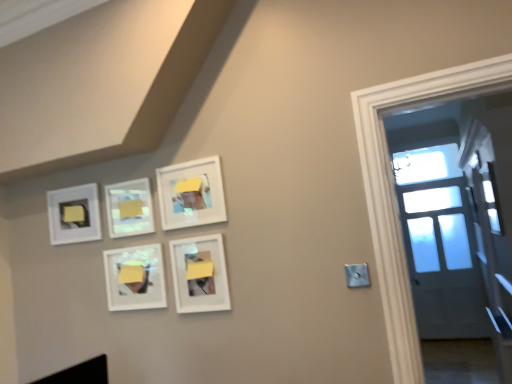
The width and height of the screenshot is (512, 384). What do you see at coordinates (74, 214) in the screenshot?
I see `matte white picture frame at upper left, which is counted as the 1th picture frame, starting from the left` at bounding box center [74, 214].

Identify the location of matte white picture frame at upper center, the 2th picture frame when ordered from left to right. The image size is (512, 384). (129, 208).

The image size is (512, 384). Identify the location of white matte picture frame at lower center, the 1th picture frame when ordered from right to left. (200, 274).

This screenshot has width=512, height=384. Describe the element at coordinates (130, 208) in the screenshot. I see `yellow matte paper at upper center, which appears as the first lift when viewed from the right` at that location.

What is the approximate height of matte white picture frame at upper center, the 2th picture frame from the right?

matte white picture frame at upper center, the 2th picture frame from the right, is 11.54 inches tall.

Locate an element on the screen. This screenshot has width=512, height=384. matte white picture frame at upper left, which appears as the 5th picture frame when viewed from the right is located at coordinates (74, 214).

Between yellow matte paper at upper center, which appears as the first lift when viewed from the right, and white matte picture frame at lower center, the 1th picture frame when ordered from right to left, which one has less height?

With less height is yellow matte paper at upper center, which appears as the first lift when viewed from the right.

How much distance is there between yellow matte paper at upper center, positioned as the first lift in front-to-back order, and white matte picture frame at lower center, the 1th picture frame when ordered from right to left?

yellow matte paper at upper center, positioned as the first lift in front-to-back order, is 15.53 inches from white matte picture frame at lower center, the 1th picture frame when ordered from right to left.

There is a white matte picture frame at lower center, which is the 5th picture frame from left to right. Where is `the 1st lift above it (from a real-world perspective)`? the 1st lift above it (from a real-world perspective) is located at coordinates (130, 208).

Between yellow matte paper at upper center, the 2th lift viewed from the back, and white matte picture frame at lower center, which is the 5th picture frame from left to right, which one has larger width?

white matte picture frame at lower center, which is the 5th picture frame from left to right, is wider.

Is yellow matte paper at upper left, arranged as the second lift when viewed from the right, smaller than white matte picture frame at lower center, which is the 5th picture frame from left to right?

Yes, yellow matte paper at upper left, arranged as the second lift when viewed from the right, is smaller than white matte picture frame at lower center, which is the 5th picture frame from left to right.

Looking at this image, from a real-world perspective, is yellow matte paper at upper left, which appears as the 1th lift when viewed from the left, above or below white matte picture frame at lower center, the 1th picture frame when ordered from right to left?

yellow matte paper at upper left, which appears as the 1th lift when viewed from the left, is situated higher than white matte picture frame at lower center, the 1th picture frame when ordered from right to left, in the real world.

Is yellow matte paper at upper left, which appears as the 1th lift when viewed from the left, oriented towards white matte picture frame at lower center, the 1th picture frame when ordered from right to left?

No.

Choose the correct answer: Is yellow matte paper at upper left, arranged as the second lift when viewed from the right, inside white matte picture frame at lower center, which is the 5th picture frame from left to right, or outside it?

yellow matte paper at upper left, arranged as the second lift when viewed from the right, is located beyond the bounds of white matte picture frame at lower center, which is the 5th picture frame from left to right.

In the scene shown: Is yellow matte paper at upper center, which appears as the first lift when viewed from the right, turned away from matte white picture frame at center-left, placed as the third picture frame when sorted from left to right?

No, matte white picture frame at center-left, placed as the third picture frame when sorted from left to right, is not at the back of yellow matte paper at upper center, which appears as the first lift when viewed from the right.

Where is `the 1st lift behind when counting from the matte white picture frame at center-left, placed as the third picture frame when sorted from left to right`? This screenshot has width=512, height=384. the 1st lift behind when counting from the matte white picture frame at center-left, placed as the third picture frame when sorted from left to right is located at coordinates (130, 208).

From a real-world perspective, is yellow matte paper at upper center, the 2th lift viewed from the back, positioned under matte white picture frame at center-left, the 3th picture frame viewed from the right, based on gravity?

No, from a real-world perspective, yellow matte paper at upper center, the 2th lift viewed from the back, is not beneath matte white picture frame at center-left, the 3th picture frame viewed from the right.

From a real-world perspective, is matte white picture frame at upper center, the 2th picture frame from the right, physically located above or below matte white picture frame at center-left, placed as the third picture frame when sorted from left to right?

matte white picture frame at upper center, the 2th picture frame from the right, is above matte white picture frame at center-left, placed as the third picture frame when sorted from left to right.

In terms of height, does matte white picture frame at upper center, the fourth picture frame from the left, look taller or shorter compared to matte white picture frame at center-left, placed as the third picture frame when sorted from left to right?

Clearly, matte white picture frame at upper center, the fourth picture frame from the left, is taller compared to matte white picture frame at center-left, placed as the third picture frame when sorted from left to right.

Does matte white picture frame at upper center, the 2th picture frame from the right, turn towards matte white picture frame at center-left, the 3th picture frame viewed from the right?

No, matte white picture frame at upper center, the 2th picture frame from the right, does not turn towards matte white picture frame at center-left, the 3th picture frame viewed from the right.

Would you say matte white picture frame at upper center, the fourth picture frame from the left, is outside matte white picture frame at center-left, placed as the third picture frame when sorted from left to right?

matte white picture frame at upper center, the fourth picture frame from the left, lies outside matte white picture frame at center-left, placed as the third picture frame when sorted from left to right,'s area.

Which is less distant, (65, 214) or (116, 211)?

Point (65, 214).

Does matte white picture frame at upper left, which is counted as the 1th picture frame, starting from the left, touch matte white picture frame at upper center, the 2th picture frame when ordered from left to right?

matte white picture frame at upper left, which is counted as the 1th picture frame, starting from the left, is not next to matte white picture frame at upper center, the 2th picture frame when ordered from left to right, and they're not touching.

Between matte white picture frame at center-left, the 3th picture frame viewed from the right, and matte white picture frame at upper left, which is counted as the 1th picture frame, starting from the left, which one has larger size?

matte white picture frame at center-left, the 3th picture frame viewed from the right, is bigger.

Is matte white picture frame at center-left, placed as the third picture frame when sorted from left to right, not within matte white picture frame at upper left, which is counted as the 1th picture frame, starting from the left?

Absolutely, matte white picture frame at center-left, placed as the third picture frame when sorted from left to right, is external to matte white picture frame at upper left, which is counted as the 1th picture frame, starting from the left.

From the image's perspective, is matte white picture frame at center-left, placed as the third picture frame when sorted from left to right, located beneath matte white picture frame at upper left, which appears as the 5th picture frame when viewed from the right?

Yes.

Could you tell me if yellow matte paper at upper left, which is the second lift from front to back, is turned towards matte white picture frame at upper left, which appears as the 5th picture frame when viewed from the right?

Yes, yellow matte paper at upper left, which is the second lift from front to back, is oriented towards matte white picture frame at upper left, which appears as the 5th picture frame when viewed from the right.

Is there a large distance between yellow matte paper at upper left, which appears as the first lift when viewed from the back, and matte white picture frame at upper left, which is counted as the 1th picture frame, starting from the left?

No, there isn't a large distance between yellow matte paper at upper left, which appears as the first lift when viewed from the back, and matte white picture frame at upper left, which is counted as the 1th picture frame, starting from the left.

Between yellow matte paper at upper left, which is the second lift from front to back, and matte white picture frame at upper left, which appears as the 5th picture frame when viewed from the right, which one has larger size?

Bigger between the two is matte white picture frame at upper left, which appears as the 5th picture frame when viewed from the right.

Find the location of a particular element. The width and height of the screenshot is (512, 384). lift that is the 1st one when counting backward from the white matte picture frame at lower center, which is the 5th picture frame from left to right is located at coordinates (130, 208).

From a real-world perspective, count 2nd lifts upward from the white matte picture frame at lower center, the 1th picture frame when ordered from right to left, and point to it. Please provide its 2D coordinates.

[(74, 214)]

Which object lies nearer to the anchor point matte white picture frame at upper center, the 2th picture frame when ordered from left to right, matte white picture frame at upper center, the 2th picture frame from the right, or white matte picture frame at lower center, which is the 5th picture frame from left to right?

Among the two, matte white picture frame at upper center, the 2th picture frame from the right, is located nearer to matte white picture frame at upper center, the 2th picture frame when ordered from left to right.

Which object lies nearer to the anchor point matte white picture frame at upper center, positioned as the 4th picture frame in right-to-left order, yellow matte paper at upper center, positioned as the first lift in front-to-back order, or matte white picture frame at upper left, which appears as the 5th picture frame when viewed from the right?

The object closer to matte white picture frame at upper center, positioned as the 4th picture frame in right-to-left order, is yellow matte paper at upper center, positioned as the first lift in front-to-back order.

Considering their positions, is matte white picture frame at upper center, the 2th picture frame from the right, positioned further to matte white picture frame at upper left, which appears as the 5th picture frame when viewed from the right, than matte white picture frame at upper center, the 2th picture frame when ordered from left to right?

Based on the image, matte white picture frame at upper center, the 2th picture frame from the right, appears to be further to matte white picture frame at upper left, which appears as the 5th picture frame when viewed from the right.

Which object lies further to the anchor point matte white picture frame at upper center, the fourth picture frame from the left, matte white picture frame at upper left, which is counted as the 1th picture frame, starting from the left, or matte white picture frame at upper center, positioned as the 4th picture frame in right-to-left order?

matte white picture frame at upper left, which is counted as the 1th picture frame, starting from the left, is positioned further to the anchor matte white picture frame at upper center, the fourth picture frame from the left.

When comparing their distances from matte white picture frame at upper center, positioned as the 4th picture frame in right-to-left order, does matte white picture frame at upper left, which is counted as the 1th picture frame, starting from the left, or white matte picture frame at lower center, the 1th picture frame when ordered from right to left, seem further?

white matte picture frame at lower center, the 1th picture frame when ordered from right to left, is positioned further to the anchor matte white picture frame at upper center, positioned as the 4th picture frame in right-to-left order.

When comparing their distances from matte white picture frame at center-left, placed as the third picture frame when sorted from left to right, does matte white picture frame at upper left, which appears as the 5th picture frame when viewed from the right, or yellow matte paper at upper left, which is the second lift from front to back, seem further?

yellow matte paper at upper left, which is the second lift from front to back.

When comparing their distances from matte white picture frame at upper center, the fourth picture frame from the left, does yellow matte paper at upper left, arranged as the second lift when viewed from the right, or yellow matte paper at upper center, which ranks as the 2th lift in left-to-right order, seem closer?

yellow matte paper at upper center, which ranks as the 2th lift in left-to-right order.

Estimate the real-world distances between objects in this image. Which object is closer to matte white picture frame at upper center, the 2th picture frame when ordered from left to right, matte white picture frame at upper center, the 2th picture frame from the right, or matte white picture frame at center-left, placed as the third picture frame when sorted from left to right?

matte white picture frame at center-left, placed as the third picture frame when sorted from left to right, is closer to matte white picture frame at upper center, the 2th picture frame when ordered from left to right.

Find the location of a particular element. The height and width of the screenshot is (384, 512). picture frame between matte white picture frame at upper left, which is counted as the 1th picture frame, starting from the left, and matte white picture frame at center-left, the 3th picture frame viewed from the right, in the horizontal direction is located at coordinates (129, 208).

Find the location of a particular element. This screenshot has width=512, height=384. picture frame between yellow matte paper at upper left, arranged as the second lift when viewed from the right, and matte white picture frame at center-left, the 3th picture frame viewed from the right, from left to right is located at coordinates (129, 208).

Find the location of a particular element. This screenshot has width=512, height=384. picture frame between yellow matte paper at upper left, arranged as the second lift when viewed from the right, and yellow matte paper at upper center, the 2th lift viewed from the back is located at coordinates (129, 208).

You are a GUI agent. You are given a task and a screenshot of the screen. Output one action in this format:
    pyautogui.click(x=<x>, y=<y>)
    Task: Click on the lift between matte white picture frame at upper left, which appears as the 5th picture frame when viewed from the right, and yellow matte paper at upper center, which ranks as the 2th lift in left-to-right order
    
    Given the screenshot: What is the action you would take?
    pyautogui.click(x=74, y=214)